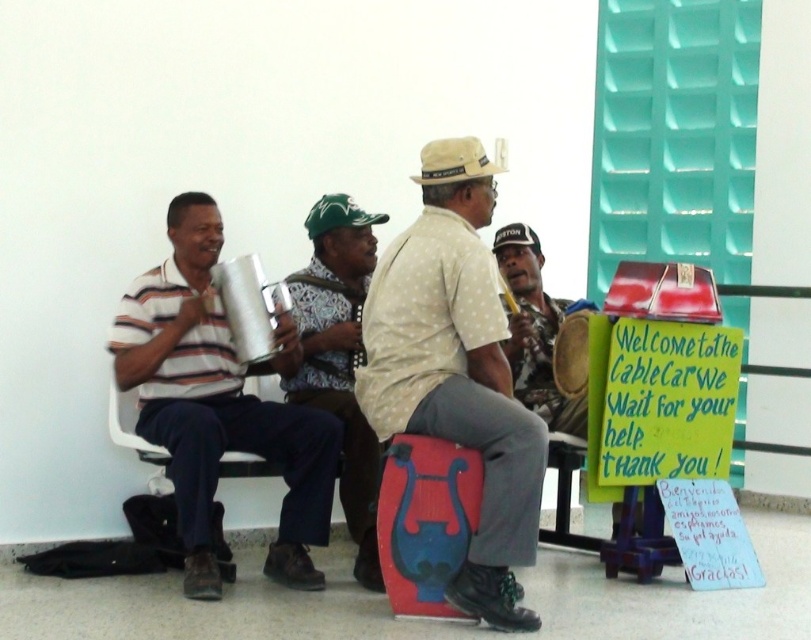
Question: Based on their relative distances, which object is farther from the patterned fabric hat at center?

Choices:
 (A) green fabric baseball cap at center
 (B) white dotted shirt at center

Answer: (B)

Question: Among these objects, which one is nearest to the camera?

Choices:
 (A) beige fabric hat at center
 (B) green fabric baseball cap at center
 (C) metallic silver cup at left
 (D) patterned fabric hat at center

Answer: (C)

Question: Is patterned fabric hat at center below green fabric baseball cap at center?

Choices:
 (A) no
 (B) yes

Answer: (B)

Question: Is patterned fabric hat at center positioned in front of white cotton baseball cap at center?

Choices:
 (A) no
 (B) yes

Answer: (B)

Question: Is white dotted shirt at center above white cotton baseball cap at center?

Choices:
 (A) no
 (B) yes

Answer: (A)

Question: Which object is closer to the camera taking this photo?

Choices:
 (A) green fabric baseball cap at center
 (B) white dotted shirt at center
 (C) white cotton baseball cap at center
 (D) patterned fabric hat at center

Answer: (B)